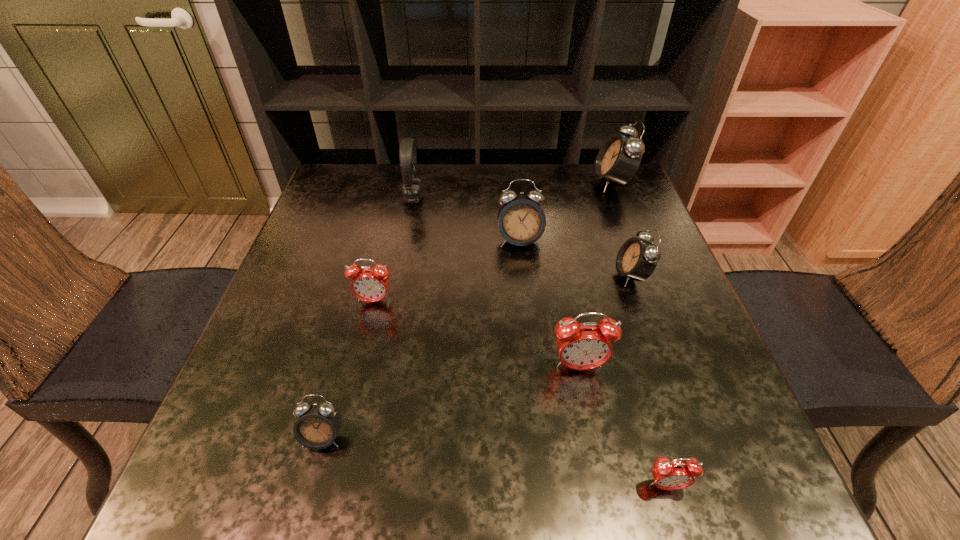
This screenshot has width=960, height=540. Find the location of `object positioned at the far right corner`. object positioned at the far right corner is located at coordinates (619, 157).

Locate an element on the screen. The height and width of the screenshot is (540, 960). object located in the near right corner section of the desktop is located at coordinates (676, 474).

In the image, there is a desktop. In order to click on free space at the far edge in this screenshot , I will do (x=539, y=177).

Identify the location of vacant space at the near edge of the desktop. The height and width of the screenshot is (540, 960). (518, 467).

Where is `vacant space at the left edge`? vacant space at the left edge is located at coordinates (359, 224).

I want to click on blank space at the right edge of the desktop, so click(629, 350).

Locate an element on the screen. Image resolution: width=960 pixels, height=540 pixels. blank space at the far left corner of the desktop is located at coordinates (342, 188).

Where is `free space at the far right corner of the desktop`? The image size is (960, 540). free space at the far right corner of the desktop is located at coordinates (630, 208).

This screenshot has height=540, width=960. Find the location of `empty space that is in between the third farthest alarm clock and the second nearest object`. empty space that is in between the third farthest alarm clock and the second nearest object is located at coordinates (477, 356).

What are the coordinates of `vacant point located between the fifth farthest object and the smallest red alarm clock` in the screenshot? It's located at (520, 393).